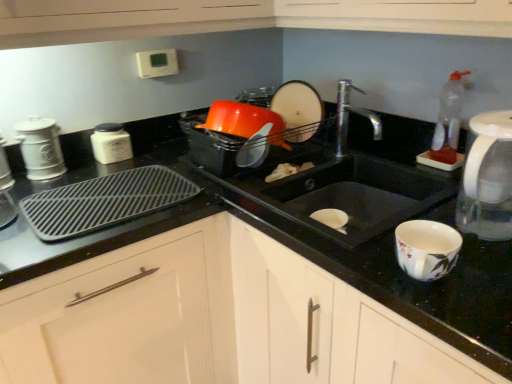
Question: From the image's perspective, is white matte jar at left, acting as the 3th appliance starting from the left, on top of white ceramic canister at left, which ranks as the second appliance in left-to-right order?

Choices:
 (A) yes
 (B) no

Answer: (A)

Question: Is white matte jar at left, positioned as the third appliance in right-to-left order, wider than white ceramic canister at left, which appears as the fourth appliance when viewed from the right?

Choices:
 (A) yes
 (B) no

Answer: (A)

Question: From the image's perspective, is white matte jar at left, positioned as the third appliance in right-to-left order, beneath white ceramic canister at left, which ranks as the second appliance in left-to-right order?

Choices:
 (A) no
 (B) yes

Answer: (A)

Question: Is white matte jar at left, positioned as the third appliance in right-to-left order, oriented away from white ceramic canister at left, which ranks as the second appliance in left-to-right order?

Choices:
 (A) no
 (B) yes

Answer: (A)

Question: Is white matte jar at left, acting as the 3th appliance starting from the left, behind white ceramic canister at left, which appears as the fourth appliance when viewed from the right?

Choices:
 (A) yes
 (B) no

Answer: (A)

Question: Relative to white matte cabinet at center, is white matte canister at left, which is the fifth appliance in right-to-left order, in front or behind?

Choices:
 (A) behind
 (B) front

Answer: (A)

Question: Considering the positions of white matte canister at left, which appears as the 1th appliance when viewed from the left, and white matte cabinet at center in the image, is white matte canister at left, which appears as the 1th appliance when viewed from the left, taller or shorter than white matte cabinet at center?

Choices:
 (A) tall
 (B) short

Answer: (B)

Question: Considering the positions of white matte canister at left, which appears as the 1th appliance when viewed from the left, and white matte cabinet at center in the image, is white matte canister at left, which appears as the 1th appliance when viewed from the left, bigger or smaller than white matte cabinet at center?

Choices:
 (A) big
 (B) small

Answer: (B)

Question: From the image's perspective, is white matte canister at left, which appears as the 1th appliance when viewed from the left, located above or below white matte cabinet at center?

Choices:
 (A) below
 (B) above

Answer: (B)

Question: In the image, is white ceramic canister at left, which ranks as the second appliance in left-to-right order, on the left side or the right side of black matte sink at center?

Choices:
 (A) left
 (B) right

Answer: (A)

Question: Considering their positions, is white ceramic canister at left, which appears as the fourth appliance when viewed from the right, located in front of or behind black matte sink at center?

Choices:
 (A) behind
 (B) front

Answer: (A)

Question: Looking at their shapes, would you say white ceramic canister at left, which appears as the fourth appliance when viewed from the right, is wider or thinner than black matte sink at center?

Choices:
 (A) wide
 (B) thin

Answer: (B)

Question: From a real-world perspective, is white ceramic canister at left, which appears as the fourth appliance when viewed from the right, physically located above or below black matte sink at center?

Choices:
 (A) below
 (B) above

Answer: (B)

Question: Considering the positions of white matte jar at left, acting as the 3th appliance starting from the left, and white matte cabinet at center in the image, is white matte jar at left, acting as the 3th appliance starting from the left, wider or thinner than white matte cabinet at center?

Choices:
 (A) wide
 (B) thin

Answer: (B)

Question: In the image, is white matte jar at left, positioned as the third appliance in right-to-left order, on the left side or the right side of white matte cabinet at center?

Choices:
 (A) left
 (B) right

Answer: (A)